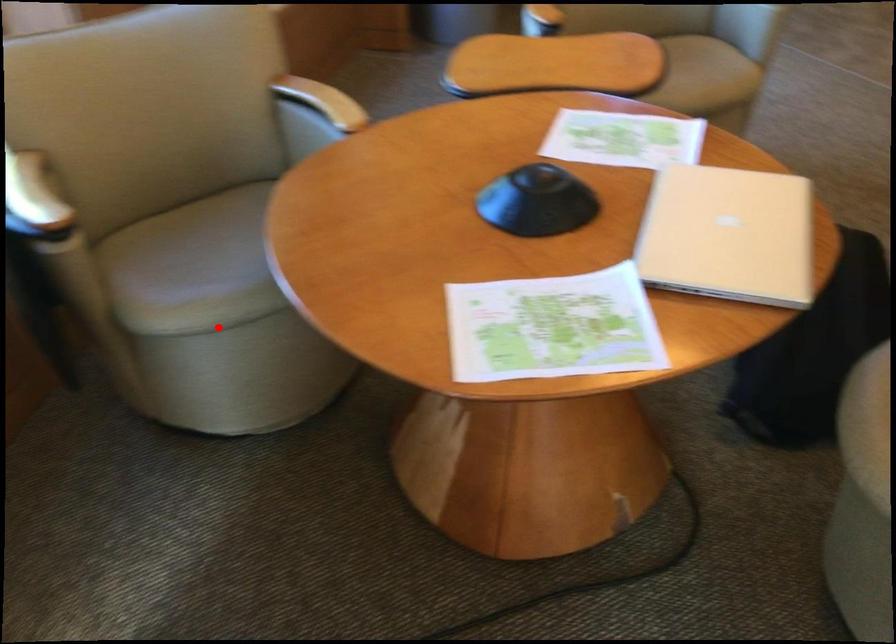
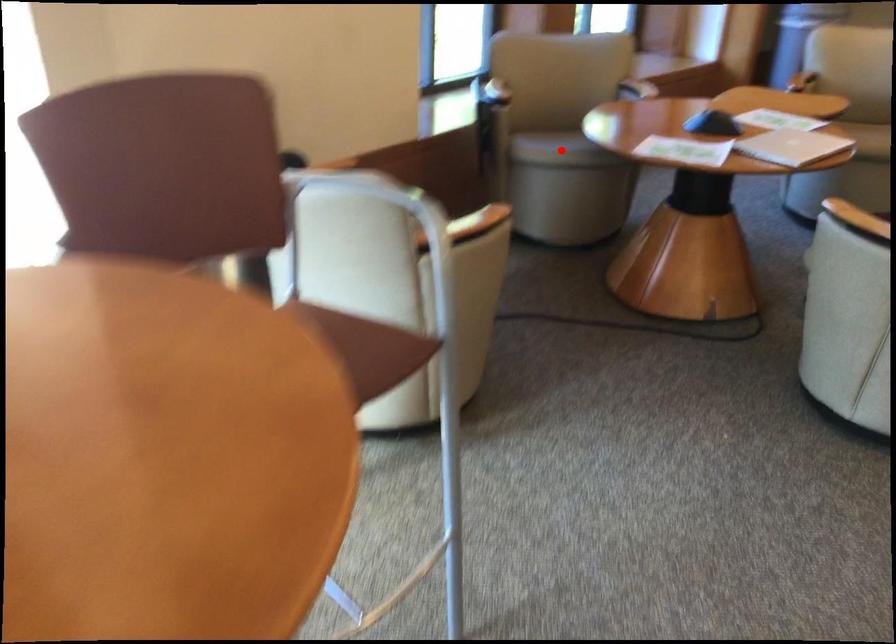
I am providing you with two images of the same scene from different viewpoints. A red point is marked on the first image and another point is marked on the second image. Are the points marked in image1 and image2 representing the same 3D position?

Yes